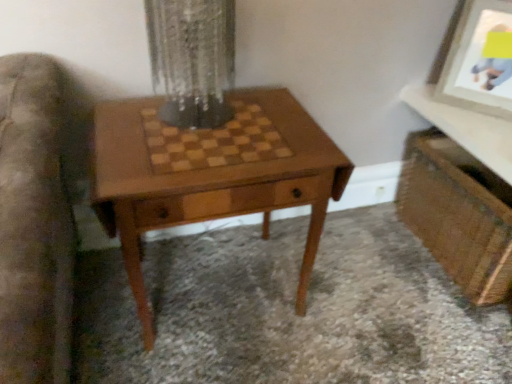
Where is `vacant space situated on the left part of clear glass vase at center`? Image resolution: width=512 pixels, height=384 pixels. vacant space situated on the left part of clear glass vase at center is located at coordinates (122, 125).